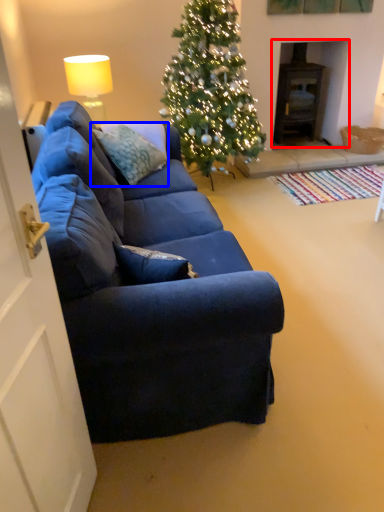
Question: Which object appears farthest to the camera in this image, fireplace (highlighted by a red box) or pillow (highlighted by a blue box)?

Choices:
 (A) fireplace
 (B) pillow

Answer: (A)